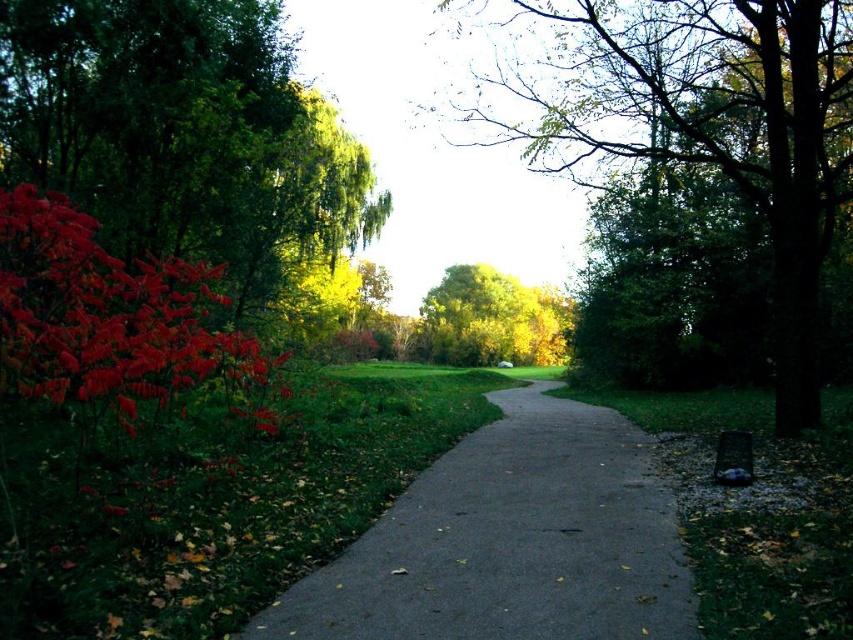
Question: Which of the following is the closest to the observer?

Choices:
 (A) (550, 326)
 (B) (491, 3)

Answer: (A)

Question: Does glossy red leaves at left appear under yellow-green leafy tree at center?

Choices:
 (A) no
 (B) yes

Answer: (A)

Question: Is vivid red leaves at left bigger than glossy red leaves at left?

Choices:
 (A) no
 (B) yes

Answer: (B)

Question: Which object appears closest to the camera in this image?

Choices:
 (A) asphalt path at center
 (B) vivid red leaves at left
 (C) yellow-green leafy tree at center

Answer: (A)

Question: Which point is farther to the camera?

Choices:
 (A) vivid red leaves at left
 (B) asphalt path at center
 (C) glossy red leaves at left
 (D) green leafy tree at center

Answer: (A)

Question: Does vivid red leaves at left have a smaller size compared to asphalt path at center?

Choices:
 (A) no
 (B) yes

Answer: (A)